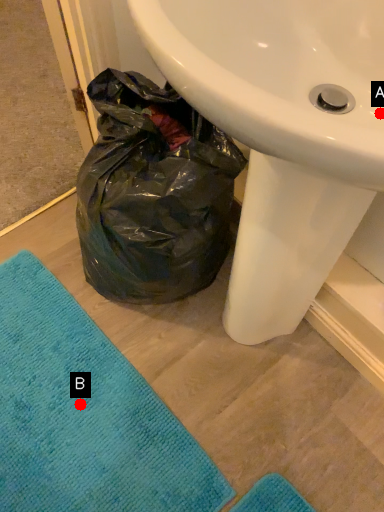
Question: Two points are circled on the image, labeled by A and B beside each circle. Which point is further to the camera?

Choices:
 (A) A is further
 (B) B is further

Answer: (B)